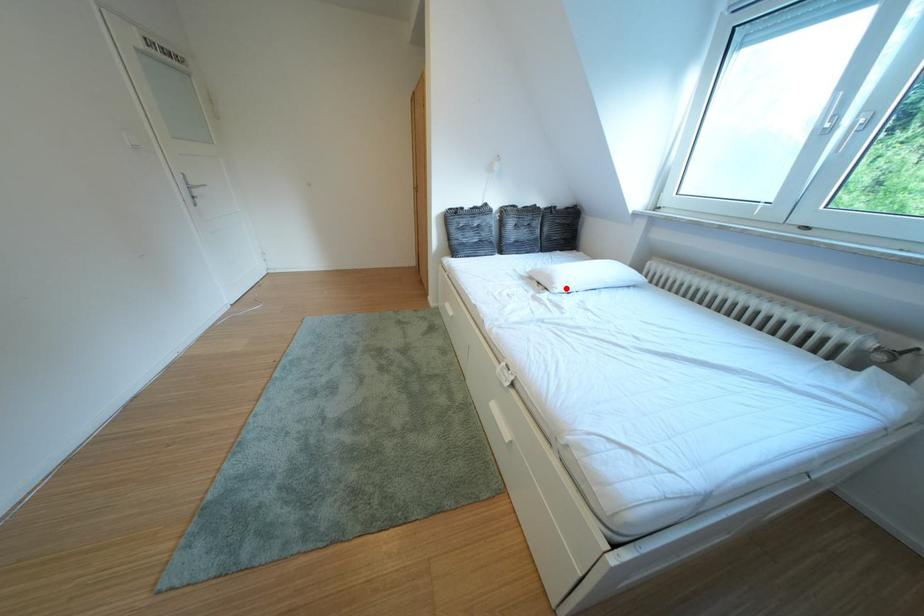
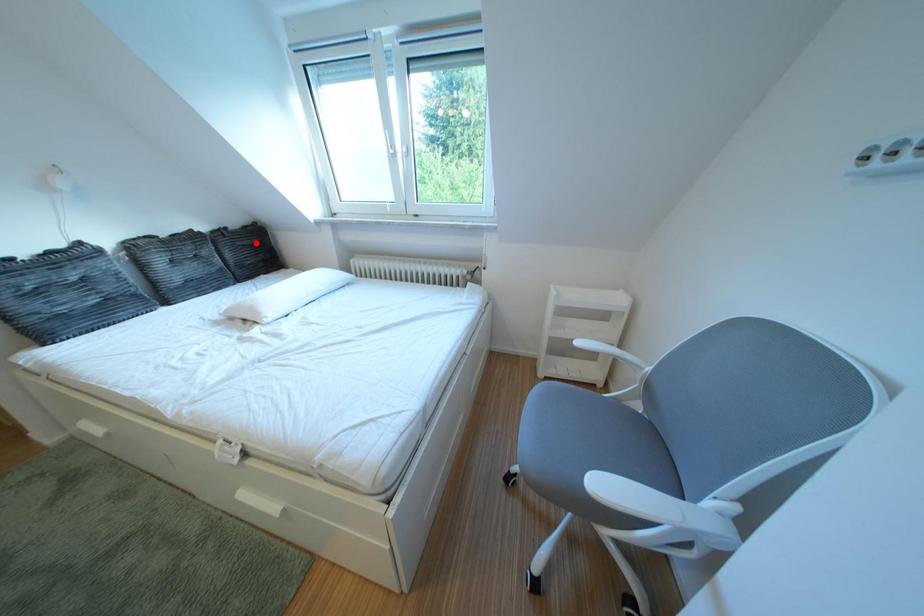
I am providing you with two images of the same scene from different viewpoints. A red point is marked on the first image and another point is marked on the second image. Do the highlighted points in image1 and image2 indicate the same real-world spot?

No